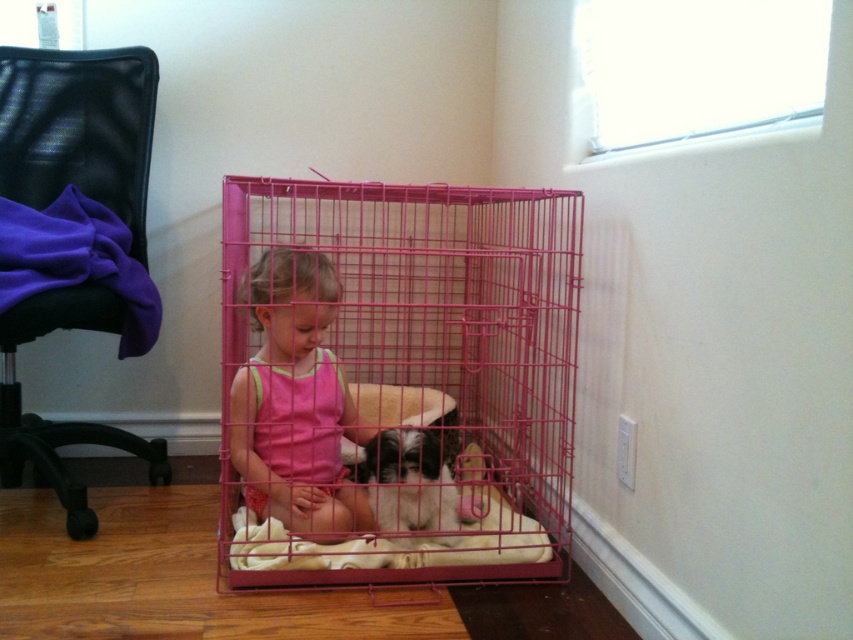
You are a toy delivery person who needs to place a new stuffed animal into the cage with the pink fabric child at center and the black and white fur at center. Based on their sizes, which child or animal would you place the toy closer to?

The pink fabric child at center is larger than the black and white fur at center, so you should place the toy closer to the pink fabric child at center to ensure it is within reach.

You are a parent trying to ensure your child is safe in the room. The pink fabric child at center is inside a cage. Where exactly is the soft beige cushion at center located relative to the child?

The soft beige cushion at center is to the right of the pink fabric child at center since the child is to the left of the cushion.

You are a parent trying to locate your child who is sitting inside the cage. You see the soft beige cushion at center and the black and white fur at center. Which object is closer to the front of the cage?

The soft beige cushion at center is in front of the black and white fur at center, so it is closer to the front of the cage.